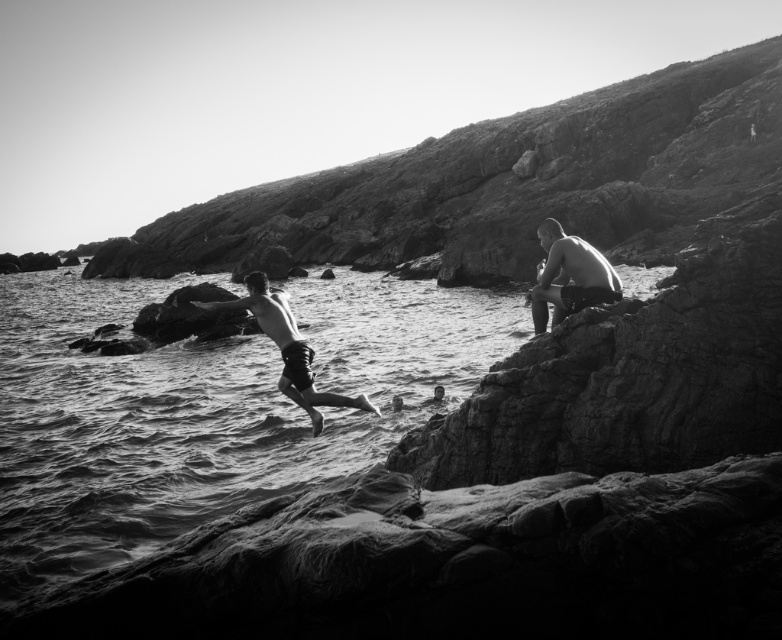
Question: Observing the image, what is the correct spatial positioning of smooth skin man at right in reference to smooth skin man at center?

Choices:
 (A) below
 (B) above

Answer: (B)

Question: Estimate the real-world distances between objects in this image. Which object is closer to the smooth skin man at center?

Choices:
 (A) smooth skin man at right
 (B) smooth water at mid-left

Answer: (A)

Question: Does smooth water at mid-left appear under smooth skin man at center?

Choices:
 (A) no
 (B) yes

Answer: (A)

Question: Does smooth water at mid-left lie in front of smooth skin man at center?

Choices:
 (A) no
 (B) yes

Answer: (B)

Question: Among these objects, which one is farthest from the camera?

Choices:
 (A) smooth skin man at center
 (B) smooth skin man at right

Answer: (A)

Question: Estimate the real-world distances between objects in this image. Which object is farther from the smooth skin man at right?

Choices:
 (A) smooth skin man at center
 (B) smooth water at mid-left

Answer: (B)